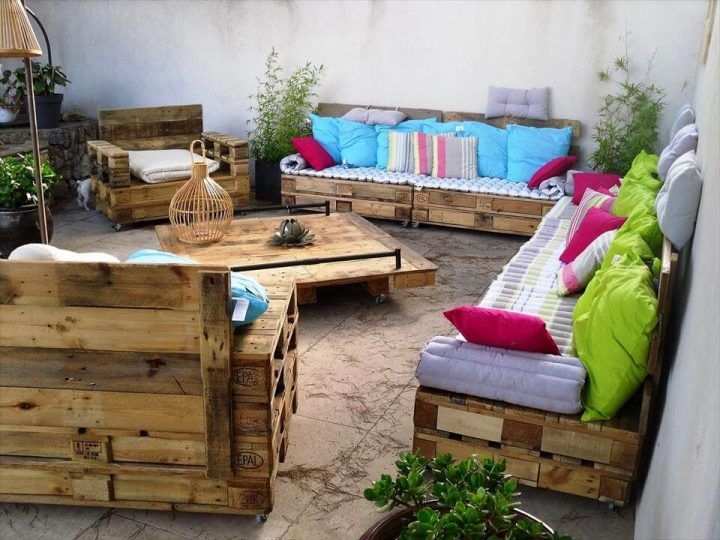
The width and height of the screenshot is (720, 540). Identify the location of wall. (508, 52), (702, 400).